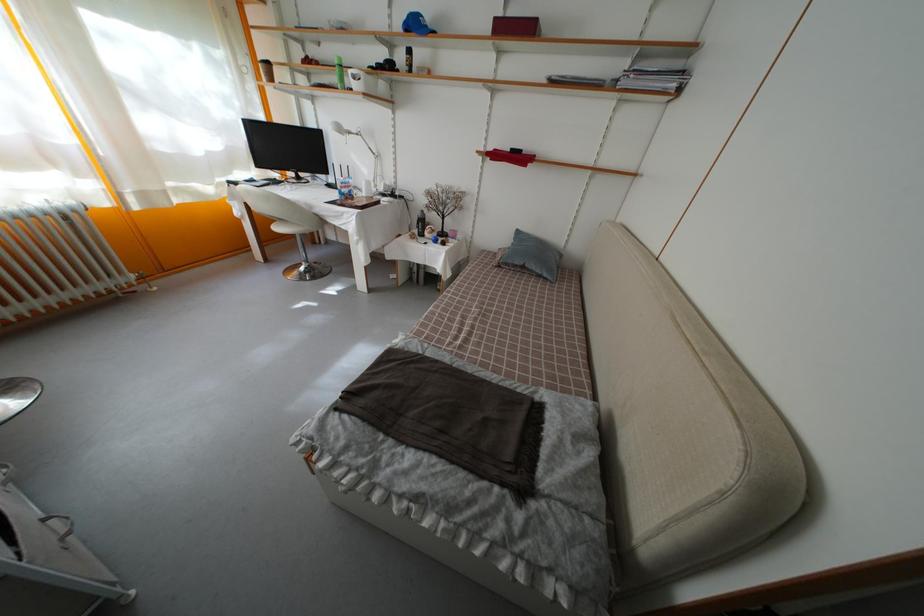
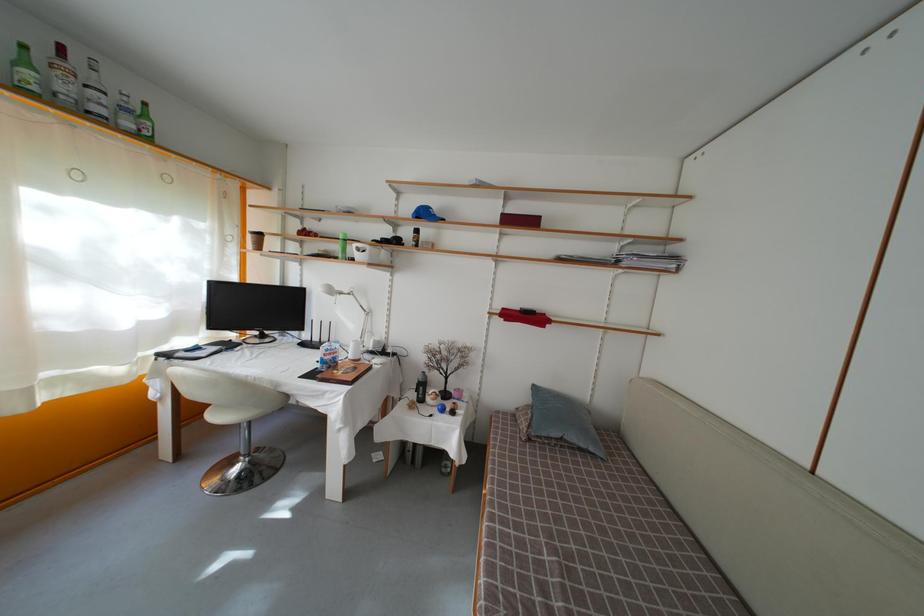
In the second image, find the point that corresponds to (x=420, y=31) in the first image.

(430, 220)